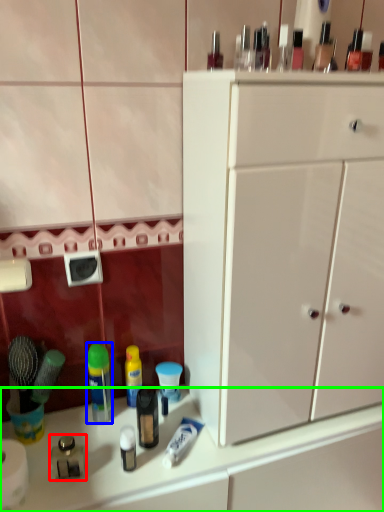
Question: Based on their relative distances, which object is farther from toiletry (highlighted by a red box)? Choose from mouthwash (highlighted by a blue box) and counter top (highlighted by a green box).

Choices:
 (A) mouthwash
 (B) counter top

Answer: (B)